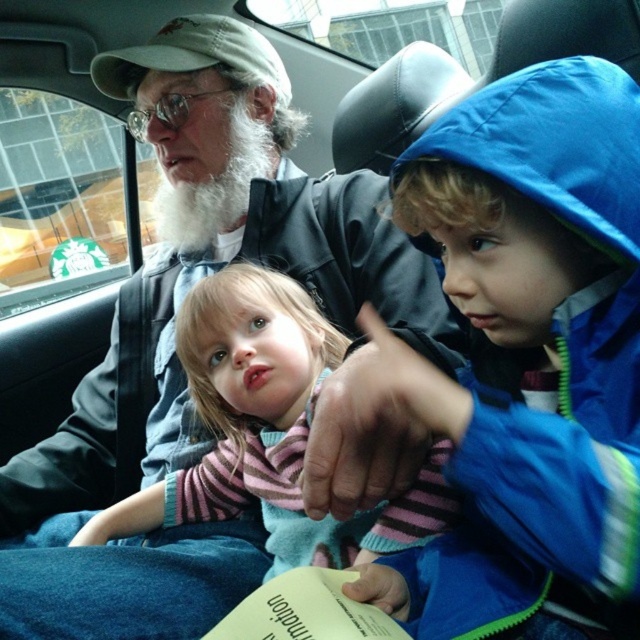
Is striped sweater at center bigger than whitewool-likebeard at center?

Yes, striped sweater at center is bigger than whitewool-likebeard at center.

Does point (200, 413) come in front of point (189, 202)?

Yes, it is.

Locate an element on the screen. striped sweater at center is located at coordinates (268, 429).

Which is more to the left, blue quilted jacket at right or gray knit cap at upper center?

gray knit cap at upper center is more to the left.

Can you confirm if blue quilted jacket at right is bigger than gray knit cap at upper center?

Actually, blue quilted jacket at right might be smaller than gray knit cap at upper center.

Locate an element on the screen. Image resolution: width=640 pixels, height=640 pixels. blue quilted jacket at right is located at coordinates (525, 358).

Which is above, blue quilted jacket at right or striped sweater at center?

blue quilted jacket at right is above.

Is point (468, 433) less distant than point (220, 321)?

Yes, point (468, 433) is in front of point (220, 321).

Between point (602, 577) and point (394, 525), which one is positioned in front?

Positioned in front is point (602, 577).

Where is `blue quilted jacket at right`? blue quilted jacket at right is located at coordinates (525, 358).